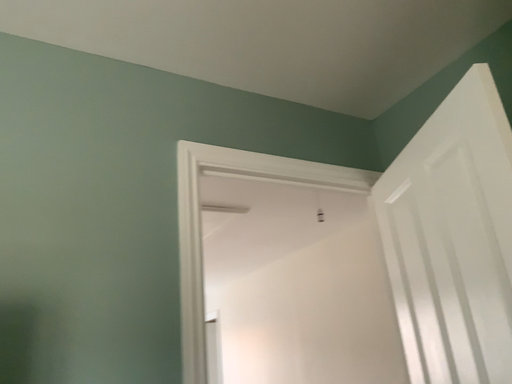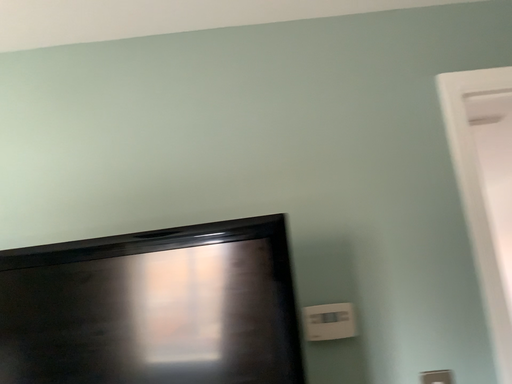
Question: Which way did the camera rotate in the video?

Choices:
 (A) rotated upward
 (B) rotated downward

Answer: (B)